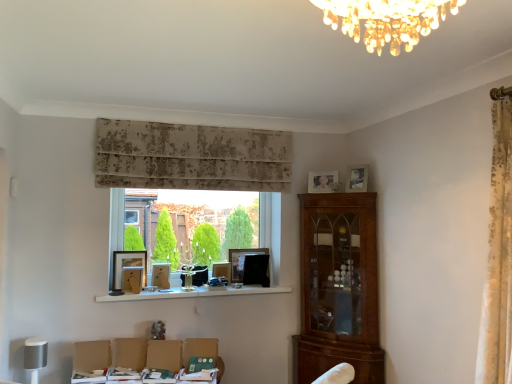
Question: Could matte wooden picture frame at center, acting as the 5th picture frame starting from the right, be considered to be inside matte black picture frame at center, acting as the 4th picture frame starting from the left?

Choices:
 (A) yes
 (B) no

Answer: (B)

Question: Is matte black picture frame at center, which appears as the 3th picture frame when viewed from the right, far away from matte wooden picture frame at center, which ranks as the 2th picture frame in left-to-right order?

Choices:
 (A) no
 (B) yes

Answer: (A)

Question: Is matte black picture frame at center, acting as the 4th picture frame starting from the left, bigger than matte wooden picture frame at center, acting as the 5th picture frame starting from the right?

Choices:
 (A) no
 (B) yes

Answer: (B)

Question: Is matte black picture frame at center, which appears as the 3th picture frame when viewed from the right, at the left side of matte wooden picture frame at center, acting as the 5th picture frame starting from the right?

Choices:
 (A) no
 (B) yes

Answer: (A)

Question: From the image's perspective, is matte black picture frame at center, which appears as the 3th picture frame when viewed from the right, on top of matte wooden picture frame at center, acting as the 5th picture frame starting from the right?

Choices:
 (A) yes
 (B) no

Answer: (A)

Question: Considering the positions of white glossy shelf at center and matte black picture frame at center, acting as the 4th picture frame starting from the left, in the image, is white glossy shelf at center taller or shorter than matte black picture frame at center, acting as the 4th picture frame starting from the left,?

Choices:
 (A) tall
 (B) short

Answer: (B)

Question: From the image's perspective, is white glossy shelf at center positioned above or below matte black picture frame at center, which appears as the 3th picture frame when viewed from the right?

Choices:
 (A) above
 (B) below

Answer: (B)

Question: Do you think white glossy shelf at center is within matte black picture frame at center, which appears as the 3th picture frame when viewed from the right, or outside of it?

Choices:
 (A) inside
 (B) outside

Answer: (B)

Question: Is white glossy shelf at center in front of or behind matte black picture frame at center, acting as the 4th picture frame starting from the left, in the image?

Choices:
 (A) behind
 (B) front

Answer: (B)

Question: From a real-world perspective, is matte black picture frame at center, which is the third picture frame in left-to-right order, above or below matte wooden picture frame at center, acting as the 5th picture frame starting from the right?

Choices:
 (A) above
 (B) below

Answer: (B)

Question: Is point (224, 281) closer or farther from the camera than point (166, 276)?

Choices:
 (A) farther
 (B) closer

Answer: (A)

Question: From the image's perspective, is matte black picture frame at center, which is the third picture frame in left-to-right order, located above or below matte wooden picture frame at center, acting as the 5th picture frame starting from the right?

Choices:
 (A) below
 (B) above

Answer: (A)

Question: From their relative heights in the image, would you say matte black picture frame at center, which is the third picture frame in left-to-right order, is taller or shorter than matte wooden picture frame at center, acting as the 5th picture frame starting from the right?

Choices:
 (A) tall
 (B) short

Answer: (A)

Question: Does point (221, 274) appear closer or farther from the camera than point (266, 233)?

Choices:
 (A) closer
 (B) farther

Answer: (A)

Question: In terms of height, does matte black picture frame at center, which is the third picture frame in left-to-right order, look taller or shorter compared to clear glass window at center?

Choices:
 (A) tall
 (B) short

Answer: (B)